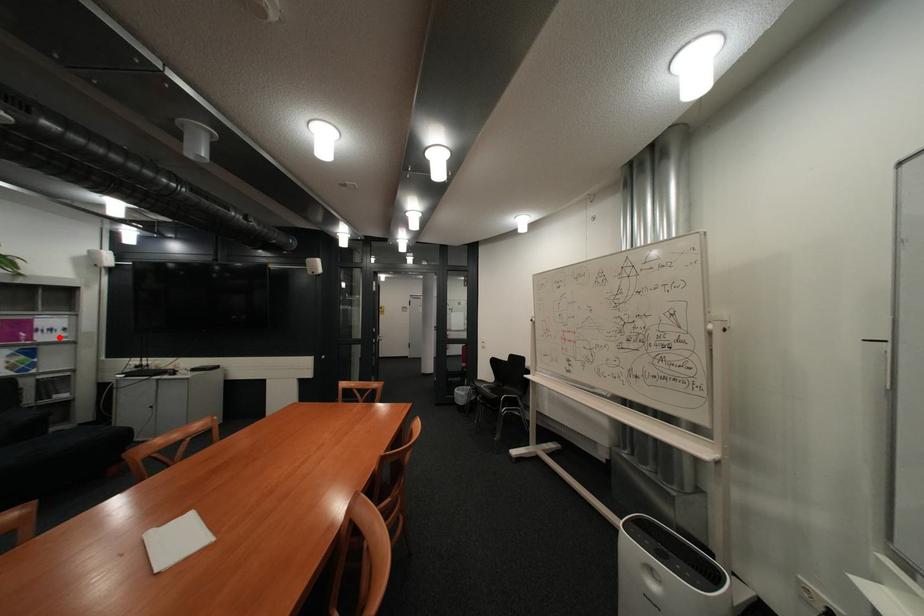
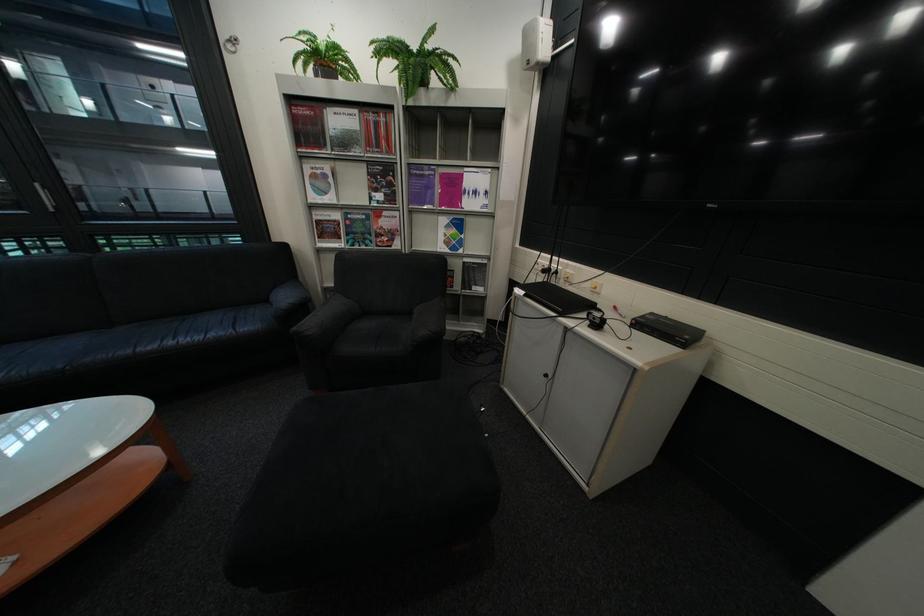
Question: I am providing you with two images of the same scene from different viewpoints. Image1 has a red point marked. In image2, the corresponding 3D location appears at what relative position? Reply with the corresponding letter.

Choices:
 (A) Closer
 (B) Farther

Answer: (A)